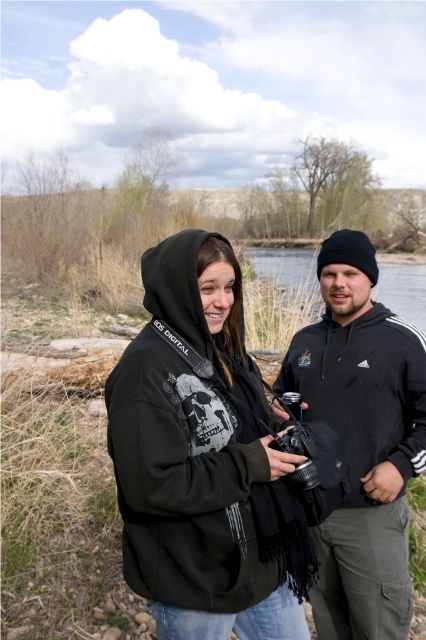
Question: Where is black matte hoodie at center located in relation to black fleece jacket at right in the image?

Choices:
 (A) right
 (B) left

Answer: (B)

Question: Which point is closer to the camera?

Choices:
 (A) (399, 435)
 (B) (259, 374)

Answer: (B)

Question: Can you confirm if black matte hoodie at center is positioned to the right of black fleece jacket at right?

Choices:
 (A) no
 (B) yes

Answer: (A)

Question: Among these points, which one is farthest from the camera?

Choices:
 (A) (406, 451)
 (B) (268, 588)

Answer: (A)

Question: Which object is farther from the camera taking this photo?

Choices:
 (A) black fleece jacket at right
 (B) black matte hoodie at center

Answer: (A)

Question: Can you confirm if black matte hoodie at center is positioned above black fleece jacket at right?

Choices:
 (A) no
 (B) yes

Answer: (B)